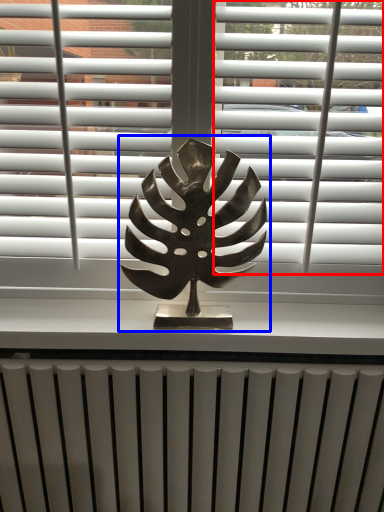
Question: Which object is closer to the camera taking this photo, blind (highlighted by a red box) or bronze statue (highlighted by a blue box)?

Choices:
 (A) blind
 (B) bronze statue

Answer: (B)